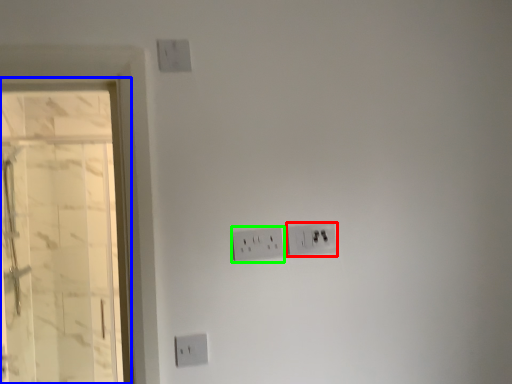
Question: Based on their relative distances, which object is nearer to power plugs and sockets (highlighted by a red box)? Choose from glass door (highlighted by a blue box) and power plugs and sockets (highlighted by a green box).

Choices:
 (A) glass door
 (B) power plugs and sockets

Answer: (B)